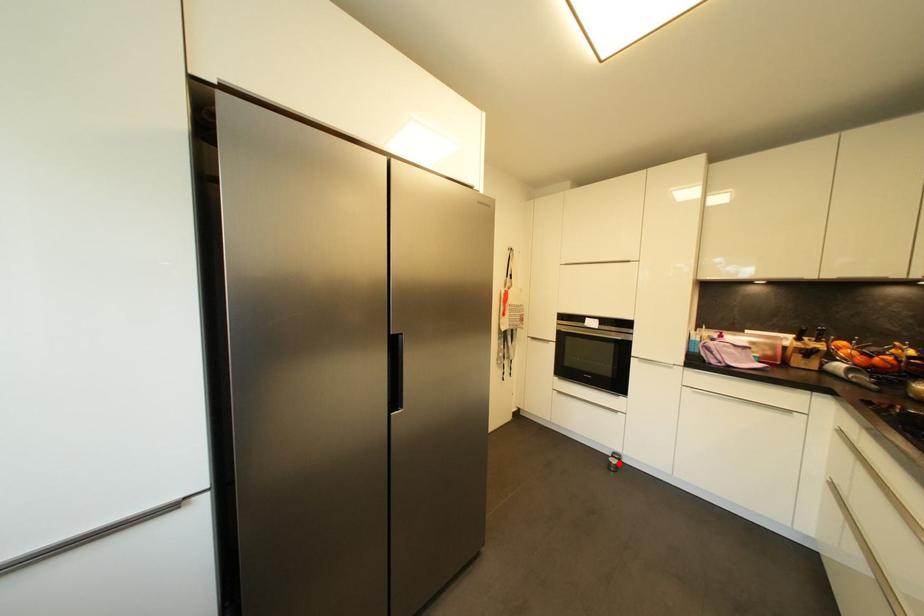
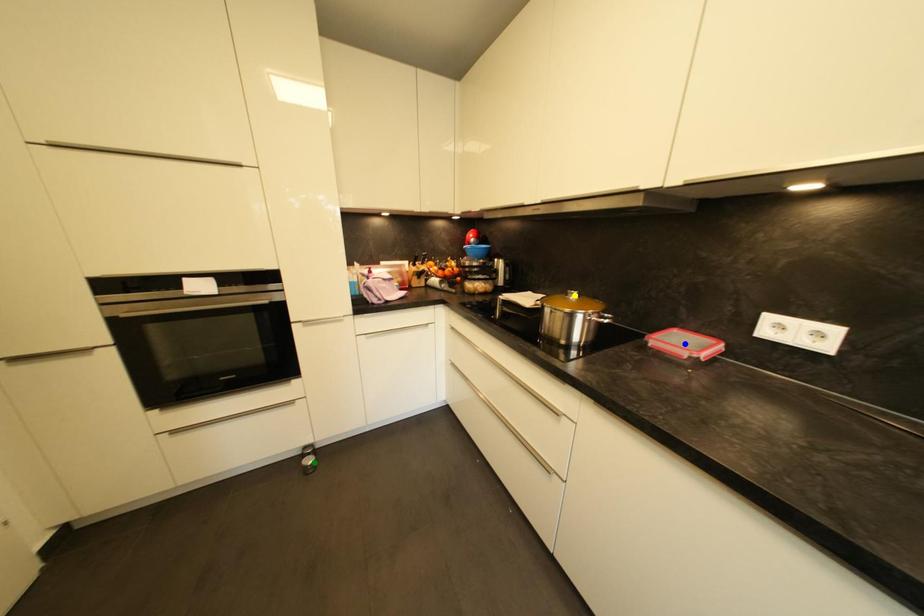
Question: I am providing you with two images of the same scene from different viewpoints. A red point is marked on the first image. You are given multiple points on the second image. Can you choose the point in image 2 that corresponds to the point in image 1?

Choices:
 (A) yellow point
 (B) blue point
 (C) green point

Answer: (C)